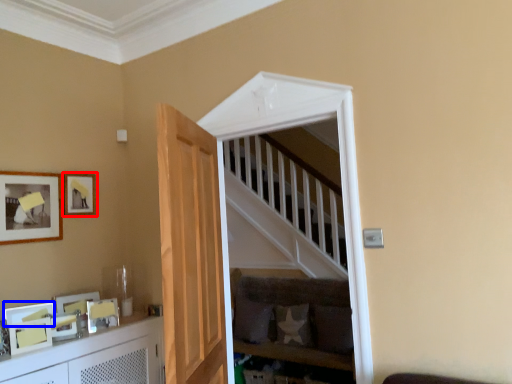
Question: Which object appears closest to the camera in this image, picture frame (highlighted by a red box) or picture frame (highlighted by a blue box)?

Choices:
 (A) picture frame
 (B) picture frame

Answer: (B)